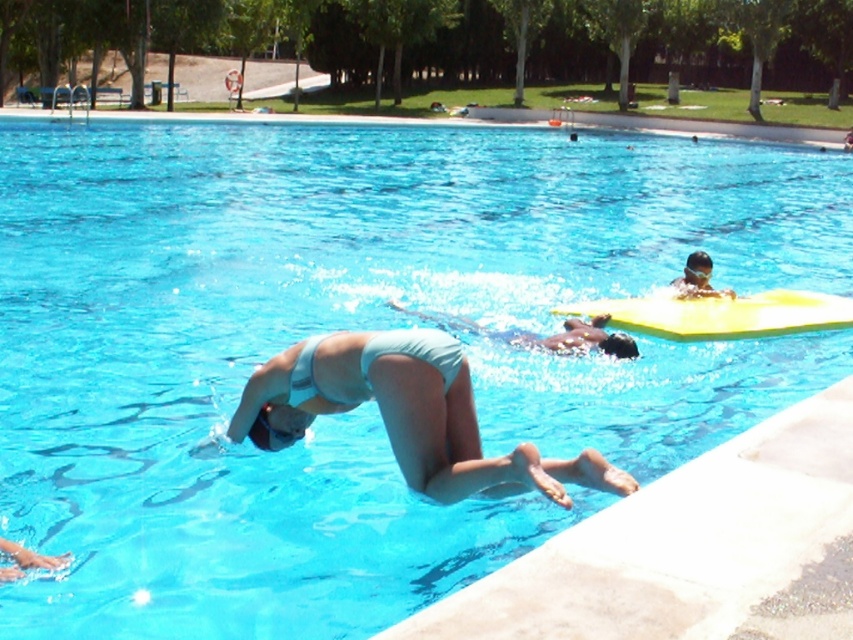
Question: Is light blue fabric bikini at center bigger than matte blue swim cap at upper right?

Choices:
 (A) no
 (B) yes

Answer: (B)

Question: Which point is farther to the camera?

Choices:
 (A) light blue fabric bikini at center
 (B) matte blue swim cap at upper right
 (C) light blue fabric swimmer at center

Answer: (B)

Question: Is light blue fabric swimmer at center below matte blue swim cap at upper right?

Choices:
 (A) yes
 (B) no

Answer: (A)

Question: Which point appears closest to the camera in this image?

Choices:
 (A) (706, 268)
 (B) (428, 403)

Answer: (B)

Question: Does light blue fabric swimmer at center have a larger size compared to matte blue swim cap at upper right?

Choices:
 (A) no
 (B) yes

Answer: (B)

Question: Among these points, which one is farthest from the camera?

Choices:
 (A) (267, 410)
 (B) (631, 339)
 (C) (705, 272)

Answer: (C)